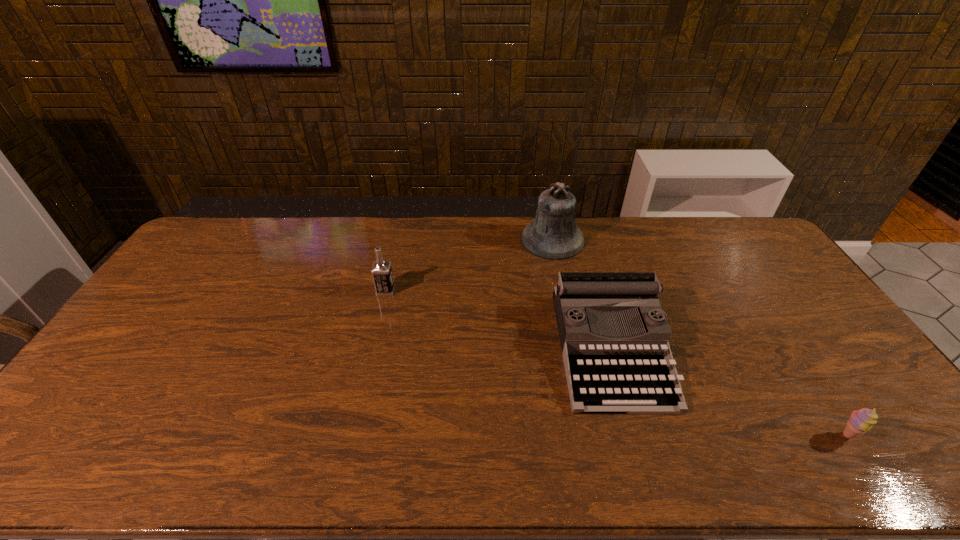
Where is `bell`? bell is located at coordinates (553, 234).

The image size is (960, 540). In order to click on the tallest object in this screenshot , I will do `click(553, 234)`.

Where is `the third nearest object`? The height and width of the screenshot is (540, 960). the third nearest object is located at coordinates (381, 271).

At what (x,y) coordinates should I click in order to perform the action: click on the leftmost object. Please return your answer as a coordinate pair (x, y). The height and width of the screenshot is (540, 960). Looking at the image, I should click on (381, 271).

At what (x,y) coordinates should I click in order to perform the action: click on typewriter. Please return your answer as a coordinate pair (x, y). Looking at the image, I should click on (614, 335).

This screenshot has width=960, height=540. Find the location of `the third farthest object`. the third farthest object is located at coordinates (614, 335).

Image resolution: width=960 pixels, height=540 pixels. Identify the location of sherbert. (861, 420).

Where is `the rightmost object`? The height and width of the screenshot is (540, 960). the rightmost object is located at coordinates (861, 420).

I want to click on vacant space located 0.390m on the right of the farthest object, so click(x=688, y=239).

I want to click on vacant space situated on the front label of the leftmost object, so click(x=421, y=291).